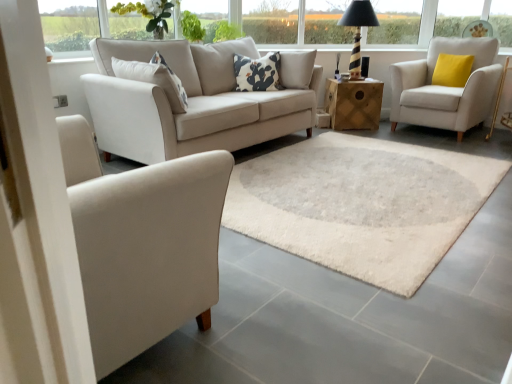
What do you see at coordinates (367, 200) in the screenshot? I see `white shaggy rug at center` at bounding box center [367, 200].

What is the approximate width of white cotton pillow at center, marked as the 1th pillow in a front-to-back arrangement?

14.06 inches.

This screenshot has width=512, height=384. Identify the location of striped wood table lamp at upper center. (358, 30).

The height and width of the screenshot is (384, 512). Describe the element at coordinates (69, 26) in the screenshot. I see `transparent glass window at upper left, the 1th window in the front-to-back sequence` at that location.

Find the location of `yellow fabric pillow at right, which is counted as the second pillow, starting from the left`. yellow fabric pillow at right, which is counted as the second pillow, starting from the left is located at coordinates (452, 70).

Where is `wooden cube at center`? The image size is (512, 384). wooden cube at center is located at coordinates (353, 104).

Locate an element on the screen. The image size is (512, 384). white fabric armchair at right, which appears as the 2th chair when ordered from the bottom is located at coordinates (446, 87).

Between yellow fabric pillow at right, which is counted as the second pillow, starting from the left, and transparent glass window at upper center, which one has smaller width?

Thinner between the two is transparent glass window at upper center.

Is yellow fabric pillow at right, the 1th pillow when ordered from back to front, directly adjacent to transparent glass window at upper center?

No, yellow fabric pillow at right, the 1th pillow when ordered from back to front, is not touching transparent glass window at upper center.

Between point (463, 73) and point (326, 2), which one is positioned behind?

The point (326, 2) is farther.

Based on their sizes in the image, would you say yellow fabric pillow at right, which is the 1th pillow from right to left, is bigger or smaller than transparent glass window at upper center?

Clearly, yellow fabric pillow at right, which is the 1th pillow from right to left, is larger in size than transparent glass window at upper center.

Considering their positions, is transparent glass window at upper left, which is the 1th window from left to right, located in front of or behind white cotton pillow at center, arranged as the 1th pillow when viewed from the left?

transparent glass window at upper left, which is the 1th window from left to right, is in front of white cotton pillow at center, arranged as the 1th pillow when viewed from the left.

Does point (90, 37) lie behind point (240, 57)?

No, it is not.

Considering the positions of objects transparent glass window at upper left, the 1th window in the front-to-back sequence, and white cotton pillow at center, arranged as the 1th pillow when viewed from the left, in the image provided, who is more to the right, transparent glass window at upper left, the 1th window in the front-to-back sequence, or white cotton pillow at center, arranged as the 1th pillow when viewed from the left,?

From the viewer's perspective, white cotton pillow at center, arranged as the 1th pillow when viewed from the left, appears more on the right side.

Between striped wood table lamp at upper center and transparent glass window at upper center, the second window positioned from the left, which one appears on the right side from the viewer's perspective?

From the viewer's perspective, striped wood table lamp at upper center appears more on the right side.

Is striped wood table lamp at upper center turned away from transparent glass window at upper center, arranged as the first window when viewed from the back?

No, striped wood table lamp at upper center is not facing the opposite direction of transparent glass window at upper center, arranged as the first window when viewed from the back.

Based on their sizes in the image, would you say transparent glass window at upper left, the second window viewed from the back, is bigger or smaller than striped wood table lamp at upper center?

Considering their sizes, transparent glass window at upper left, the second window viewed from the back, takes up less space than striped wood table lamp at upper center.

Is transparent glass window at upper left, the second window positioned from the top, not within striped wood table lamp at upper center?

Yes, transparent glass window at upper left, the second window positioned from the top, is not within striped wood table lamp at upper center.

Does transparent glass window at upper left, positioned as the 2th window in right-to-left order, appear on the right side of striped wood table lamp at upper center?

No, transparent glass window at upper left, positioned as the 2th window in right-to-left order, is not to the right of striped wood table lamp at upper center.

Can you confirm if transparent glass window at upper left, the second window viewed from the back, is shorter than striped wood table lamp at upper center?

Indeed, transparent glass window at upper left, the second window viewed from the back, has a lesser height compared to striped wood table lamp at upper center.

Does point (125, 32) appear closer or farther from the camera than point (350, 99)?

Point (125, 32) appears to be closer to the viewer than point (350, 99).

Between green leafy plant at upper center and wooden cube at center, which one appears on the right side from the viewer's perspective?

A: wooden cube at center.

Are green leafy plant at upper center and wooden cube at center far apart?

That's right, there is a large distance between green leafy plant at upper center and wooden cube at center.

Does matte white armchair at left, the 1th chair from the front, have a larger size compared to transparent glass window at upper center, marked as the 2th window in a bottom-to-top arrangement?

Indeed, matte white armchair at left, the 1th chair from the front, has a larger size compared to transparent glass window at upper center, marked as the 2th window in a bottom-to-top arrangement.

Is matte white armchair at left, the 1th chair from the front, positioned far away from transparent glass window at upper center, the second window positioned from the left?

That's right, there is a large distance between matte white armchair at left, the 1th chair from the front, and transparent glass window at upper center, the second window positioned from the left.

From the image's perspective, is matte white armchair at left, the second chair when ordered from back to front, located above or below transparent glass window at upper center, which is the 2th window in front-to-back order?

matte white armchair at left, the second chair when ordered from back to front, is situated lower than transparent glass window at upper center, which is the 2th window in front-to-back order, in the image.

Is matte white armchair at left, the second chair when ordered from back to front, looking in the opposite direction of transparent glass window at upper center, arranged as the first window when viewed from the back?

No, matte white armchair at left, the second chair when ordered from back to front, is not facing the opposite direction of transparent glass window at upper center, arranged as the first window when viewed from the back.

Which object is further away from the camera taking this photo, transparent glass window at upper left, which is the 1th window from left to right, or matte white armchair at left, the 1th chair from the front?

transparent glass window at upper left, which is the 1th window from left to right, is further away from the camera.

Could you tell me if transparent glass window at upper left, arranged as the first window when ordered from the bottom, is turned towards matte white armchair at left, marked as the first chair in a left-to-right arrangement?

Yes, transparent glass window at upper left, arranged as the first window when ordered from the bottom, is aimed at matte white armchair at left, marked as the first chair in a left-to-right arrangement.

Which of these two, transparent glass window at upper left, the second window positioned from the top, or matte white armchair at left, which is counted as the second chair, starting from the top, stands shorter?

Standing shorter between the two is transparent glass window at upper left, the second window positioned from the top.

Is transparent glass window at upper left, which is the 1th window from left to right, positioned far away from matte white armchair at left, marked as the first chair in a left-to-right arrangement?

Absolutely, transparent glass window at upper left, which is the 1th window from left to right, is distant from matte white armchair at left, marked as the first chair in a left-to-right arrangement.

This screenshot has height=384, width=512. What are the coordinates of `window frame that is on the left side of yellow fabric pillow at right, the 1th pillow when ordered from back to front` in the screenshot? It's located at (395, 22).

The width and height of the screenshot is (512, 384). I want to click on window in front of the white cotton pillow at center, marked as the 1th pillow in a front-to-back arrangement, so click(69, 26).

Estimate the real-world distances between objects in this image. Which object is further from green leafy plant at upper center, transparent glass window at upper center, arranged as the first window when viewed from the back, or white fabric armchair at right, the first chair positioned from the back?

The object further to green leafy plant at upper center is white fabric armchair at right, the first chair positioned from the back.

Based on their spatial positions, is striped wood table lamp at upper center or yellow fabric pillow at right, which is counted as the second pillow, starting from the left, further from transparent glass window at upper left, which is the 1th window from left to right?

yellow fabric pillow at right, which is counted as the second pillow, starting from the left, lies further to transparent glass window at upper left, which is the 1th window from left to right, than the other object.

Estimate the real-world distances between objects in this image. Which object is closer to transparent glass window at upper center, transparent glass window at upper left, the 1th window in the front-to-back sequence, or transparent glass window at upper center, which is the 2th window in front-to-back order?

transparent glass window at upper center, which is the 2th window in front-to-back order, is closer to transparent glass window at upper center.

Looking at the image, which one is located closer to transparent glass window at upper left, the second window viewed from the back, white shaggy rug at center or white fabric armchair at right, which appears as the 2th chair when viewed from the front?

white shaggy rug at center is positioned closer to the anchor transparent glass window at upper left, the second window viewed from the back.

Looking at the image, which one is located closer to white fabric armchair at right, which appears as the 2th chair when viewed from the front, wooden cube at center or green leafy plant at upper center?

Based on the image, wooden cube at center appears to be nearer to white fabric armchair at right, which appears as the 2th chair when viewed from the front.

Looking at the image, which one is located closer to transparent glass window at upper center, green leafy plant at upper center or wooden cube at center?

Based on the image, wooden cube at center appears to be nearer to transparent glass window at upper center.

Estimate the real-world distances between objects in this image. Which object is further from wooden cube at center, striped wood table lamp at upper center or transparent glass window at upper center, marked as the 1th window in a right-to-left arrangement?

Based on the image, transparent glass window at upper center, marked as the 1th window in a right-to-left arrangement, appears to be further to wooden cube at center.

When comparing their distances from striped wood table lamp at upper center, does yellow fabric pillow at right, which is counted as the second pillow, starting from the left, or transparent glass window at upper left, positioned as the 2th window in right-to-left order, seem closer?

Based on the image, yellow fabric pillow at right, which is counted as the second pillow, starting from the left, appears to be nearer to striped wood table lamp at upper center.

The height and width of the screenshot is (384, 512). Find the location of `table between green leafy plant at upper center and yellow fabric pillow at right, the 1th pillow when ordered from back to front, in the horizontal direction`. table between green leafy plant at upper center and yellow fabric pillow at right, the 1th pillow when ordered from back to front, in the horizontal direction is located at coordinates (353, 104).

The image size is (512, 384). What are the coordinates of `chair between matte white armchair at left, placed as the 2th chair when sorted from right to left, and wooden cube at center from front to back` in the screenshot? It's located at (446, 87).

Locate an element on the screen. The width and height of the screenshot is (512, 384). table lamp located between matte white armchair at left, the second chair when ordered from back to front, and wooden cube at center in the depth direction is located at coordinates (358, 30).

Locate an element on the screen. flower between matte white armchair at left, the 1th chair from the front, and white cotton pillow at center, the second pillow when ordered from back to front, from front to back is located at coordinates (148, 14).